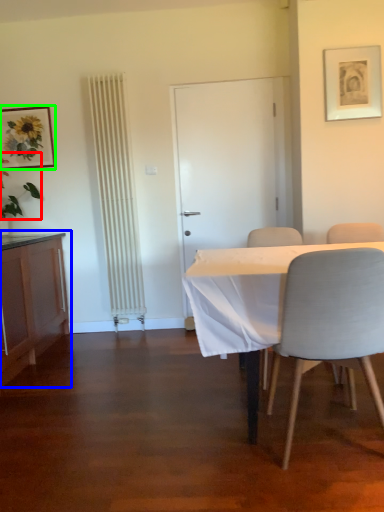
Question: Based on their relative distances, which object is farther from plant (highlighted by a red box)? Choose from cabinetry (highlighted by a blue box) and picture frame (highlighted by a green box).

Choices:
 (A) cabinetry
 (B) picture frame

Answer: (A)